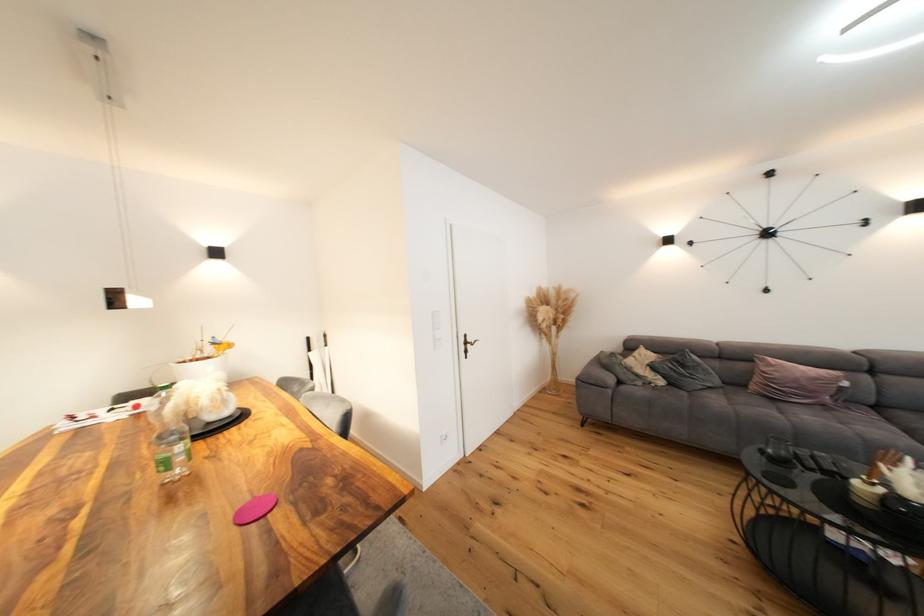
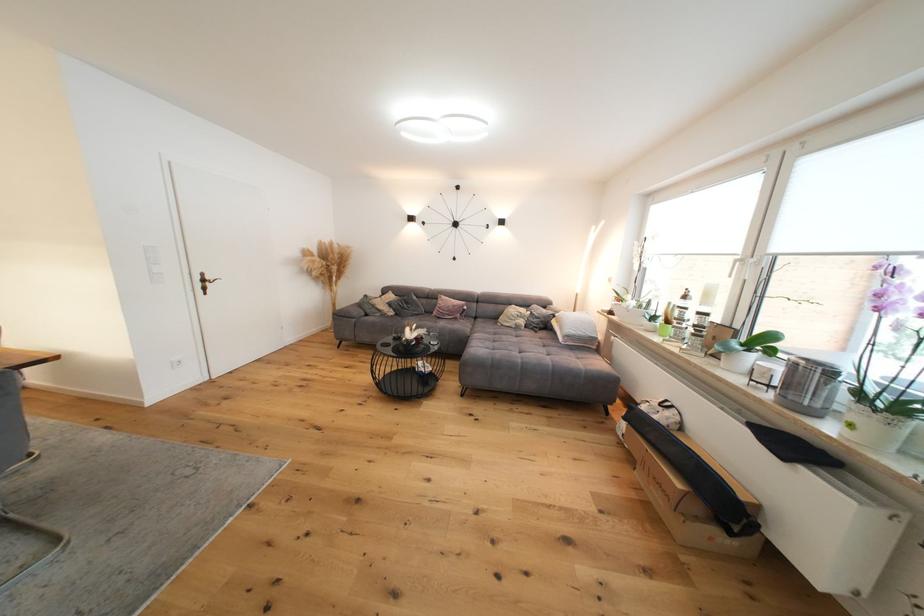
Locate, in the second image, the point that corresponds to the point at 473,344 in the first image.

(211, 282)